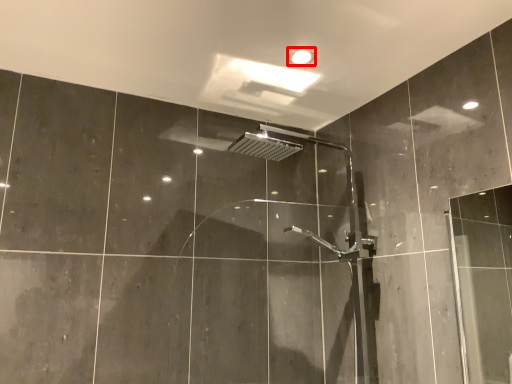
Question: From the image's perspective, what is the correct spatial positioning of light fixture (annotated by the red box) in reference to screen door?

Choices:
 (A) below
 (B) above

Answer: (B)